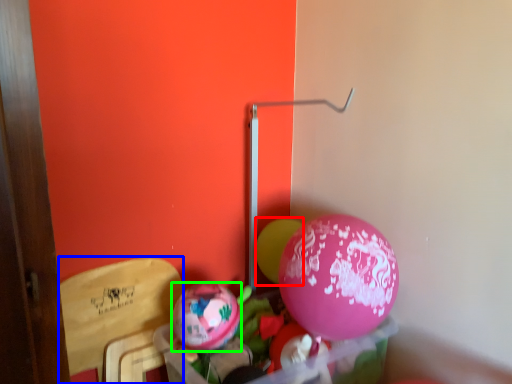
Question: Which object is positioned farthest from balloon (highlighted by a red box)? Select from armchair (highlighted by a blue box) and balloon (highlighted by a green box).

Choices:
 (A) armchair
 (B) balloon

Answer: (A)